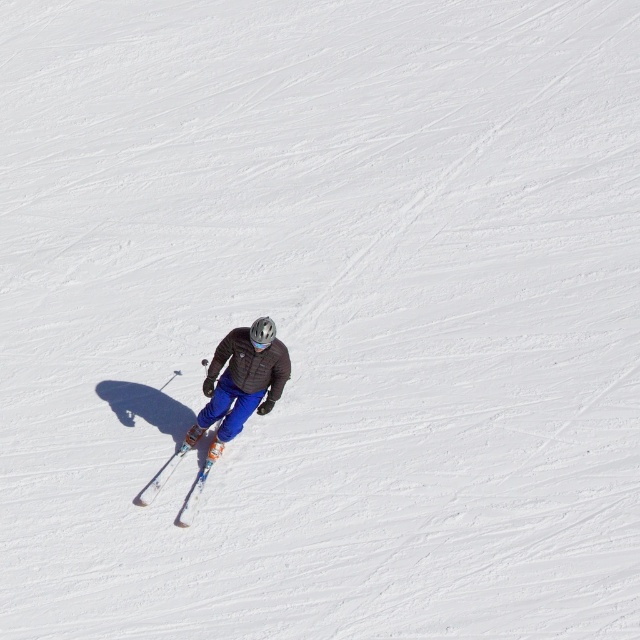
You are a photographer trying to capture the skier from an aerial view. You want to ensure that both the matte blue ski pants at center and the white plastic ski at center are visible in your shot. Based on their positions, which object should appear closer to the top of the photo?

The matte blue ski pants at center is located above the white plastic ski at center, so it will appear closer to the top of the photo.

You are a drone operator flying a drone that is 1.2 meters wide. You want to capture a closeup shot of the skier while maintaining a safe distance. The camera is positioned at the point where the drone is located. The point you need to focus on is point (x=282, y=376). Can the drone safely hover at the camera position to take the photo without getting too close to the skier?

The point (x=282, y=376) is 13.51 meters away from the camera. Since the drone is 1.2 meters wide, it can safely hover at the camera position to take the photo as the distance is sufficient to avoid being too close to the skier.

You are a drone operator trying to capture a photo of the skier. You need to adjust your drone to focus on two specific points in the scene. The first point is at coordinates point (x=240, y=422) and the second is at point (x=209, y=452). Which point should you focus on first if you want to ensure the closest point to the viewer is in sharp focus?

Point (x=240, y=422) is closer to the viewer than point (x=209, y=452), so you should focus on point (x=240, y=422) first to ensure the closest point is in sharp focus.